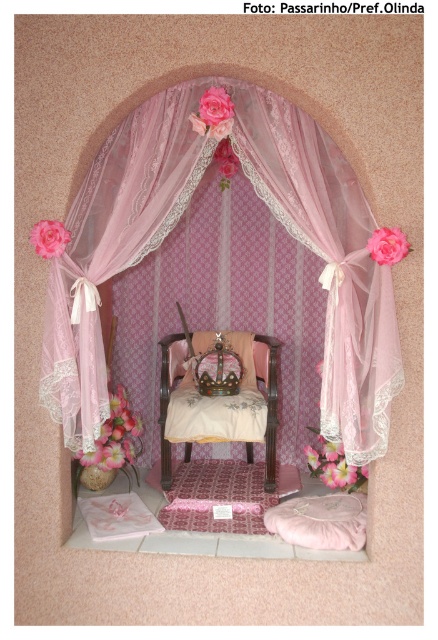
Is velvet gold chair at center wider than pink fabric flower at center?

Correct, the width of velvet gold chair at center exceeds that of pink fabric flower at center.

What do you see at coordinates (268, 397) in the screenshot? I see `velvet gold chair at center` at bounding box center [268, 397].

The image size is (438, 640). I want to click on velvet gold chair at center, so click(268, 397).

Is pink fabric flower at center positioned before matte pink rose at center?

That is True.

Does pink fabric flower at center appear on the right side of matte pink rose at center?

Yes, pink fabric flower at center is to the right of matte pink rose at center.

Between point (389, 241) and point (48, 225), which one is positioned in front?

Point (389, 241)

Where is `pink fabric flower at center`? pink fabric flower at center is located at coordinates coord(388,244).

Does velvet gold chair at center have a lesser width compared to matte pink rose at center?

In fact, velvet gold chair at center might be wider than matte pink rose at center.

Does velvet gold chair at center have a greater height compared to matte pink rose at center?

Yes.

Locate an element on the screen. velvet gold chair at center is located at coordinates (268, 397).